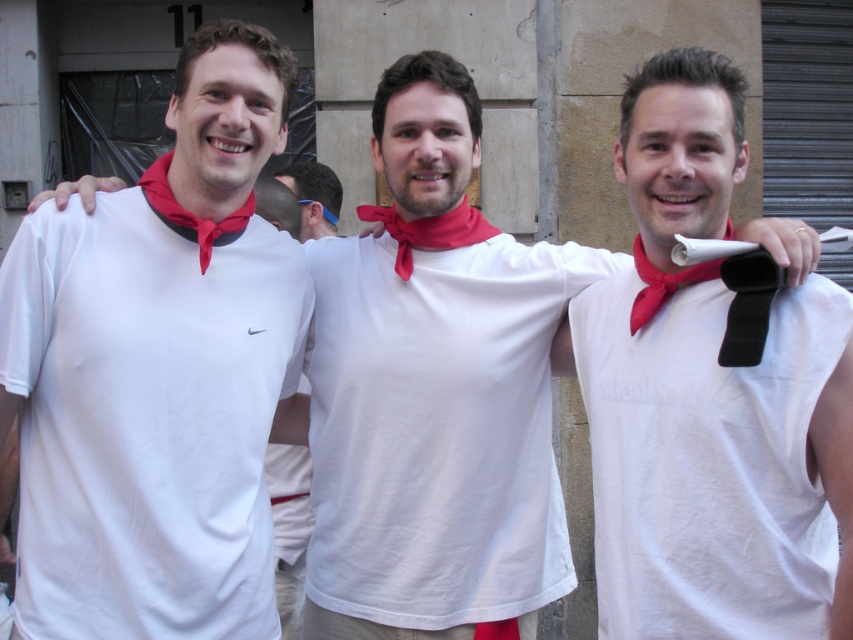
Question: Which of the following is the closest to the observer?

Choices:
 (A) (181, 214)
 (B) (821, 502)

Answer: (B)

Question: Is white matte shirt at left in front of white matte shirt at center?

Choices:
 (A) no
 (B) yes

Answer: (A)

Question: Among these objects, which one is farthest from the camera?

Choices:
 (A) white matte shirt at left
 (B) red satin bow tie at left
 (C) white cotton shirt at center
 (D) red satin necktie at center

Answer: (C)

Question: Can you confirm if white matte shirt at center is smaller than blue plastic ear at center?

Choices:
 (A) no
 (B) yes

Answer: (A)

Question: Which of these objects is positioned closest to the matte red scarf at center?

Choices:
 (A) red satin bow tie at center
 (B) white cotton shirt at center
 (C) red satin bow tie at left

Answer: (A)

Question: Can you confirm if white matte shirt at center is positioned to the right of matte red scarf at center?

Choices:
 (A) no
 (B) yes

Answer: (A)